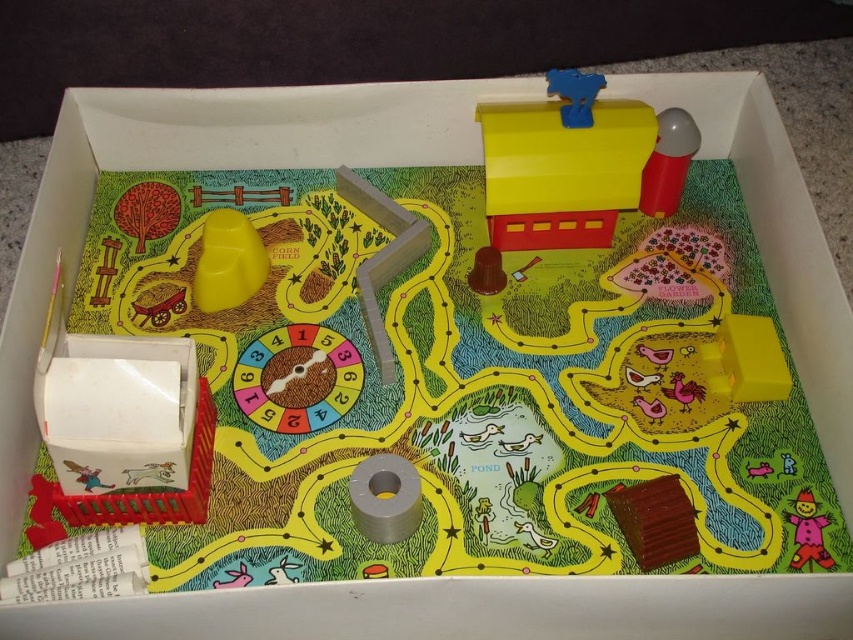
You are playing the board game and your game piece is currently at the center of the board. You need to deliver a letter to the matte plastic mailbox at upper right. Which direction should you move your piece to reach the mailbox?

Since the matte plastic mailbox at upper right is located at point (578, 164), you should move your piece towards the upper right direction to reach it.

You are holding a smartphone camera and want to take a photo of the point at coordinates point [537,209] on the game board. The camera is currently 4.15 feet away from the point. If the smartphone has a standard zoom level, which allows focusing clearly up to 3 feet away, will the photo be in focus?

The point [537,209] is 4.15 feet away from the camera, which is beyond the smartphone camera standard zoom focus range of 3 feet. Therefore, the photo will not be in focus.

You are a player in the board game and need to deliver a letter to the matte pink scarecrow at lower right. The only path available goes past the matte plastic mailbox at upper right. Can you reach the scarecrow without passing the mailbox?

The matte pink scarecrow at lower right is behind the matte plastic mailbox at upper right, so you can reach the matte pink scarecrow at lower right without passing the matte plastic mailbox at upper right.